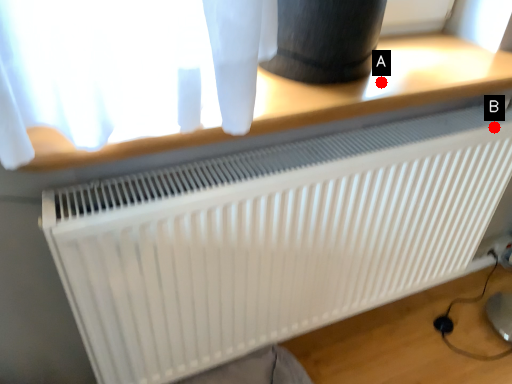
Question: Two points are circled on the image, labeled by A and B beside each circle. Among these points, which one is nearest to the camera?

Choices:
 (A) A is closer
 (B) B is closer

Answer: (A)